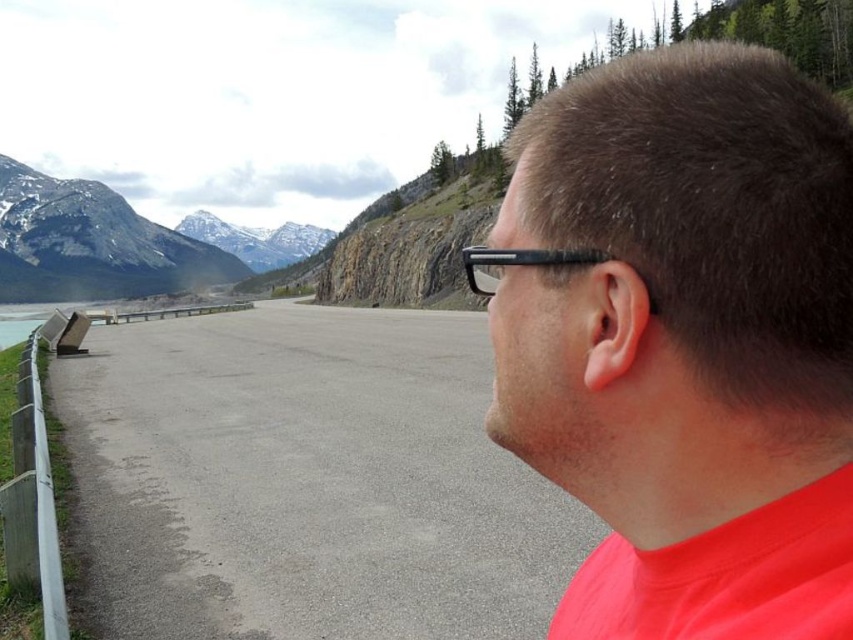
You are planning to place a small potted plant between the gray asphalt road at center and the brushed metal bench at left. Since the road is lower than the bench, where should you position the plant so it is visible from both the road and the bench?

The gray asphalt road at center has a lesser height compared to the brushed metal bench at left, so positioning the plant between them at a mid height would ensure visibility from both the road and the bench.

You are a photographer trying to capture the matte black glasses at upper right in the scene. The camera you are using has a focus point at coordinate point (685, 340). Will this focus point be effective for capturing the matte black glasses at upper right?

The point (685, 340) corresponds to the matte black glasses at upper right, so yes, the focus point at coordinate point (685, 340) will effectively capture the matte black glasses at upper right.